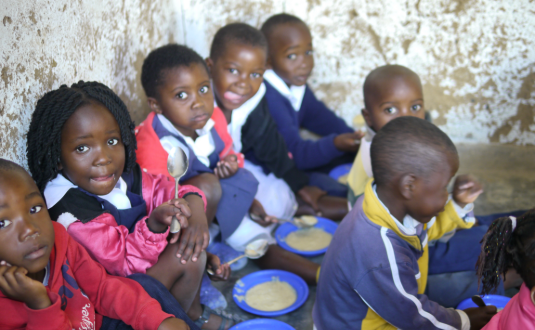
The height and width of the screenshot is (330, 535). Find the location of `spoons`. spoons is located at coordinates (178, 166), (259, 245), (308, 221).